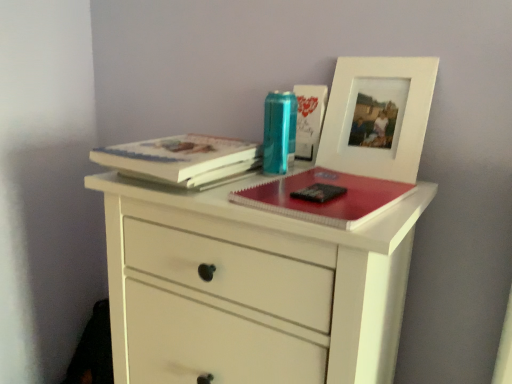
Where is `empty space that is ontop of matte red notebook at center`? Image resolution: width=512 pixels, height=384 pixels. empty space that is ontop of matte red notebook at center is located at coordinates (334, 195).